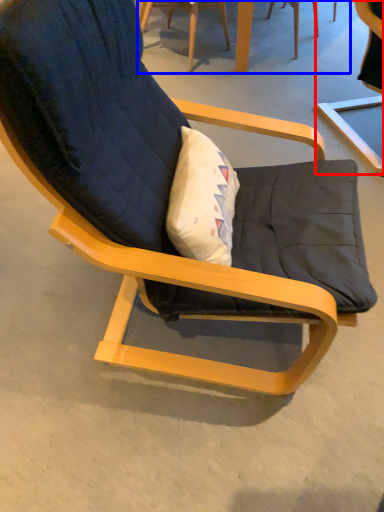
Question: Which object is closer to the camera taking this photo, chair (highlighted by a red box) or table (highlighted by a blue box)?

Choices:
 (A) chair
 (B) table

Answer: (A)